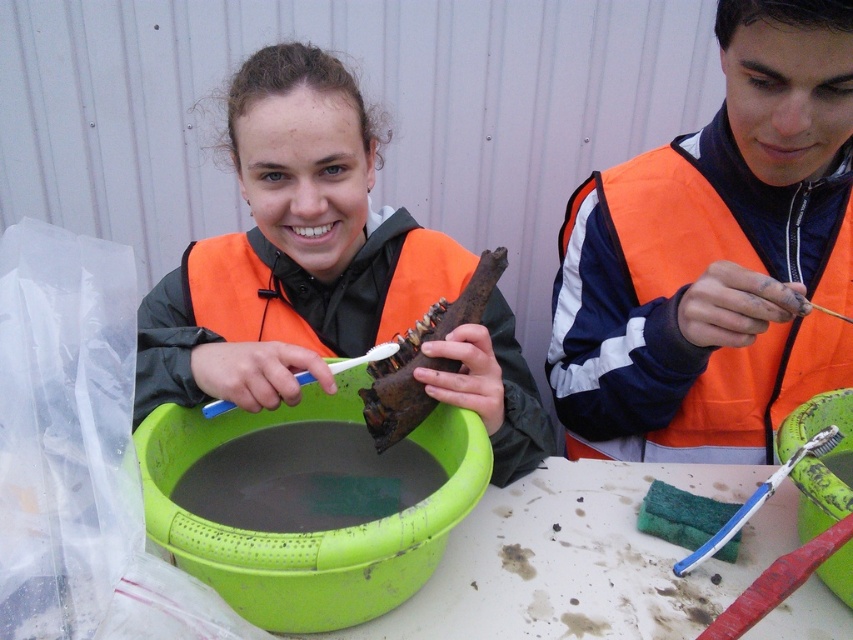
You are a photographer trying to capture a closeup of the green plastic bowl at center and the rusty metal lobster at center. Which object should you focus on first to ensure both are in the frame without moving the camera?

The green plastic bowl at center is closer to the viewer, so focus on it first. Since it is nearer, adjusting the focus starting from the green plastic bowl at center will help ensure both it and the rusty metal lobster at center remain in the frame without needing to move the camera.